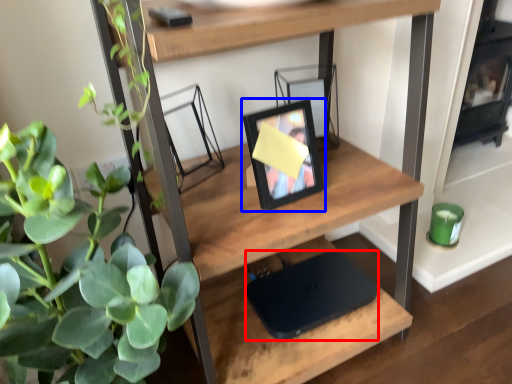
Question: Which of the following is the farthest to the observer, laptop (highlighted by a red box) or picture frame (highlighted by a blue box)?

Choices:
 (A) laptop
 (B) picture frame

Answer: (A)